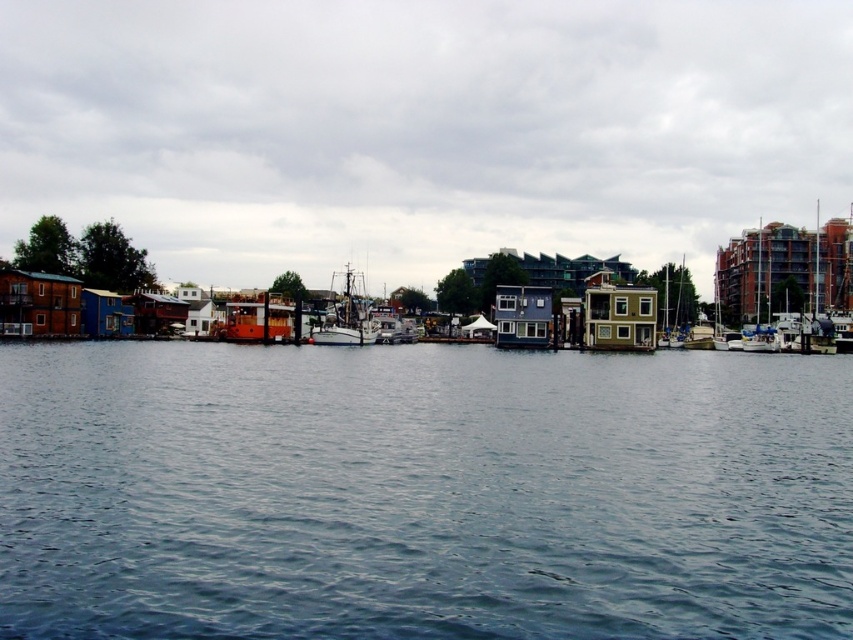
In the scene shown: Does blue water at center appear under wooden ship at center?

Indeed, blue water at center is positioned under wooden ship at center.

Measure the distance from blue water at center to wooden ship at center.

The distance of blue water at center from wooden ship at center is 54.70 meters.

Between point (799, 461) and point (347, 316), which one is positioned in front?

Point (799, 461) is in front.

Where is `blue water at center`? The image size is (853, 640). blue water at center is located at coordinates (421, 492).

Which is more to the right, blue water at center or wooden cabin boat at center?

blue water at center

Is the position of blue water at center more distant than that of wooden cabin boat at center?

No, blue water at center is in front of wooden cabin boat at center.

Is point (846, 502) positioned behind point (286, 330)?

No.

Locate an element on the screen. The image size is (853, 640). blue water at center is located at coordinates (421, 492).

Can you confirm if wooden ship at center is bigger than brick red building at right?

Actually, wooden ship at center might be smaller than brick red building at right.

Who is taller, wooden ship at center or brick red building at right?

brick red building at right is taller.

Is point (363, 333) farther from viewer compared to point (757, 296)?

That is False.

Find the location of `wooden ship at center`. wooden ship at center is located at coordinates (346, 316).